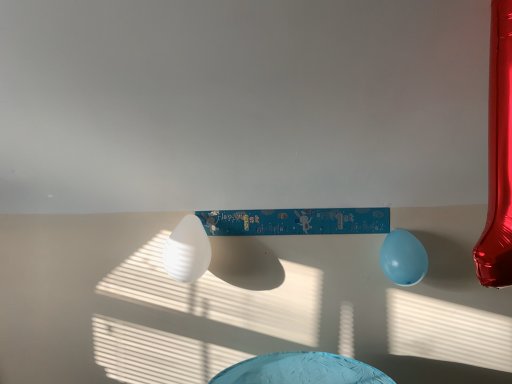
Question: Considering the relative sizes of white matte balloon at center, marked as the 1th balloon in a left-to-right arrangement, and light blue rubber balloon at lower right, the 2th balloon viewed from the left, in the image provided, is white matte balloon at center, marked as the 1th balloon in a left-to-right arrangement, wider than light blue rubber balloon at lower right, the 2th balloon viewed from the left,?

Choices:
 (A) yes
 (B) no

Answer: (A)

Question: From a real-world perspective, is white matte balloon at center, the second balloon from the right, located higher than light blue rubber balloon at lower right, the 2th balloon viewed from the left?

Choices:
 (A) yes
 (B) no

Answer: (A)

Question: Is white matte balloon at center, marked as the 1th balloon in a left-to-right arrangement, taller than light blue rubber balloon at lower right, the 2th balloon viewed from the left?

Choices:
 (A) yes
 (B) no

Answer: (A)

Question: Can you confirm if white matte balloon at center, the second balloon from the right, is positioned to the right of light blue rubber balloon at lower right, the 1th balloon when ordered from right to left?

Choices:
 (A) yes
 (B) no

Answer: (B)

Question: Is white matte balloon at center, marked as the 1th balloon in a left-to-right arrangement, thinner than light blue rubber balloon at lower right, the 1th balloon when ordered from right to left?

Choices:
 (A) no
 (B) yes

Answer: (A)

Question: From the image's perspective, is white matte balloon at center, marked as the 1th balloon in a left-to-right arrangement, above light blue rubber balloon at lower right, the 1th balloon when ordered from right to left?

Choices:
 (A) yes
 (B) no

Answer: (A)

Question: Does light blue rubber balloon at lower right, the 1th balloon when ordered from right to left, turn towards white matte balloon at center, marked as the 1th balloon in a left-to-right arrangement?

Choices:
 (A) no
 (B) yes

Answer: (A)

Question: Is light blue rubber balloon at lower right, the 1th balloon when ordered from right to left, facing away from white matte balloon at center, marked as the 1th balloon in a left-to-right arrangement?

Choices:
 (A) no
 (B) yes

Answer: (A)

Question: Does light blue rubber balloon at lower right, the 1th balloon when ordered from right to left, have a lesser width compared to white matte balloon at center, the second balloon from the right?

Choices:
 (A) no
 (B) yes

Answer: (B)

Question: Can you confirm if light blue rubber balloon at lower right, the 2th balloon viewed from the left, is bigger than white matte balloon at center, marked as the 1th balloon in a left-to-right arrangement?

Choices:
 (A) no
 (B) yes

Answer: (A)

Question: Can you confirm if light blue rubber balloon at lower right, the 2th balloon viewed from the left, is shorter than white matte balloon at center, marked as the 1th balloon in a left-to-right arrangement?

Choices:
 (A) no
 (B) yes

Answer: (B)

Question: From a real-world perspective, is white matte balloon at center, marked as the 1th balloon in a left-to-right arrangement, physically located above or below light blue rubber balloon at lower right, the 2th balloon viewed from the left?

Choices:
 (A) above
 (B) below

Answer: (A)